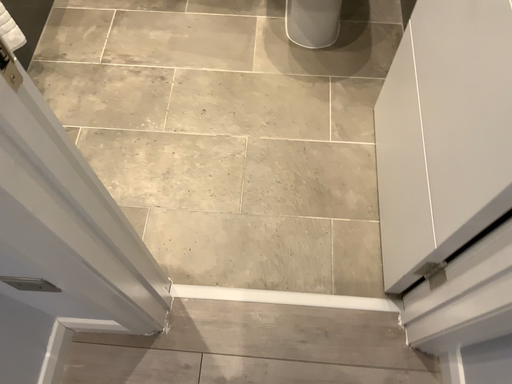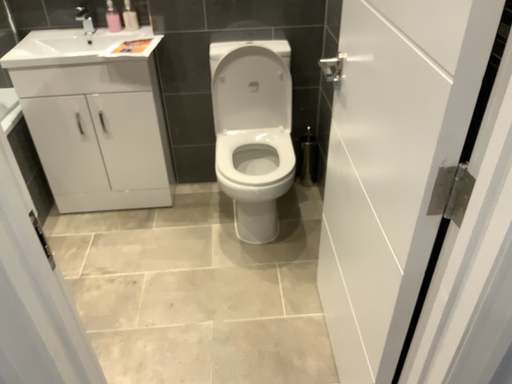
Question: How did the camera likely rotate when shooting the video?

Choices:
 (A) rotated upward
 (B) rotated downward

Answer: (A)